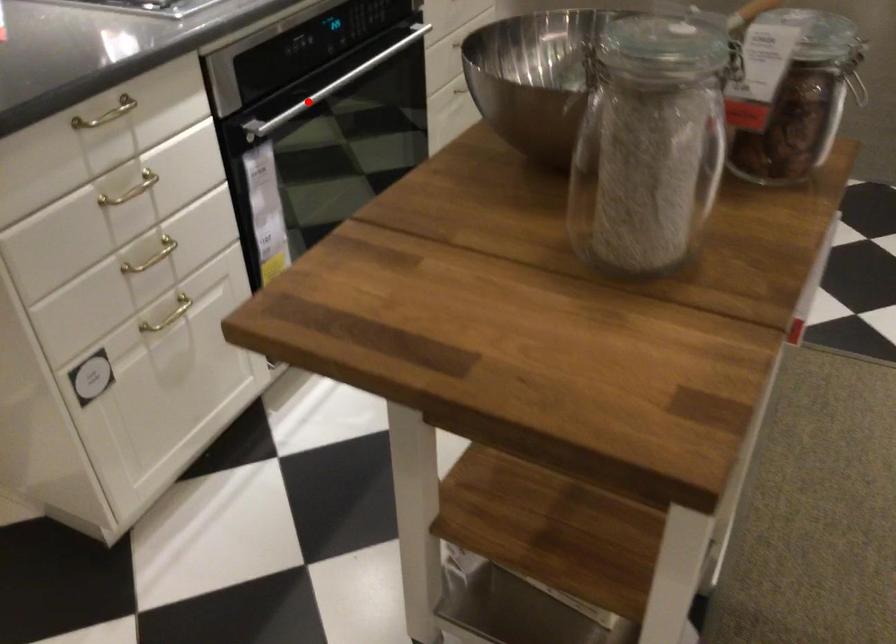
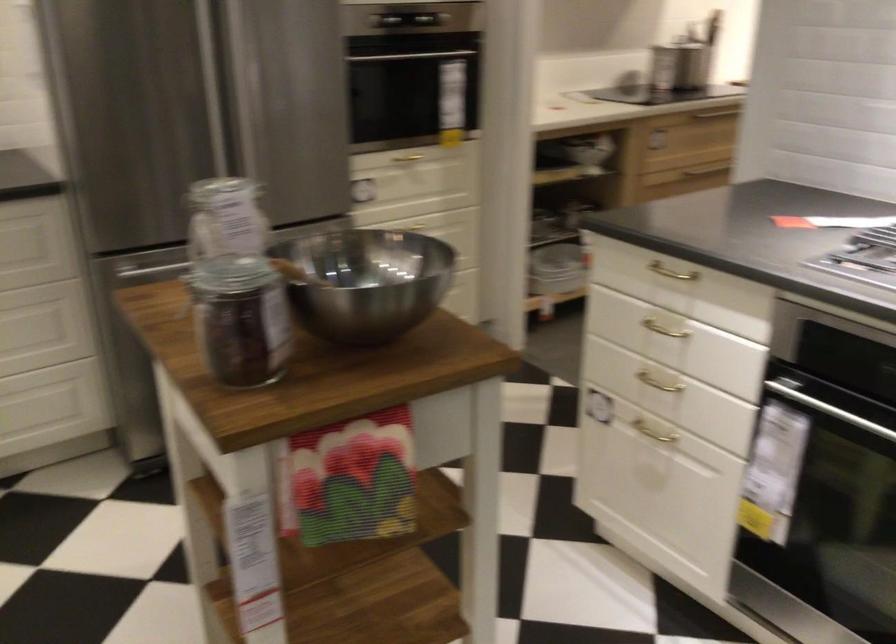
The point at the highlighted location is marked in the first image. Where is the corresponding point in the second image?

(826, 408)